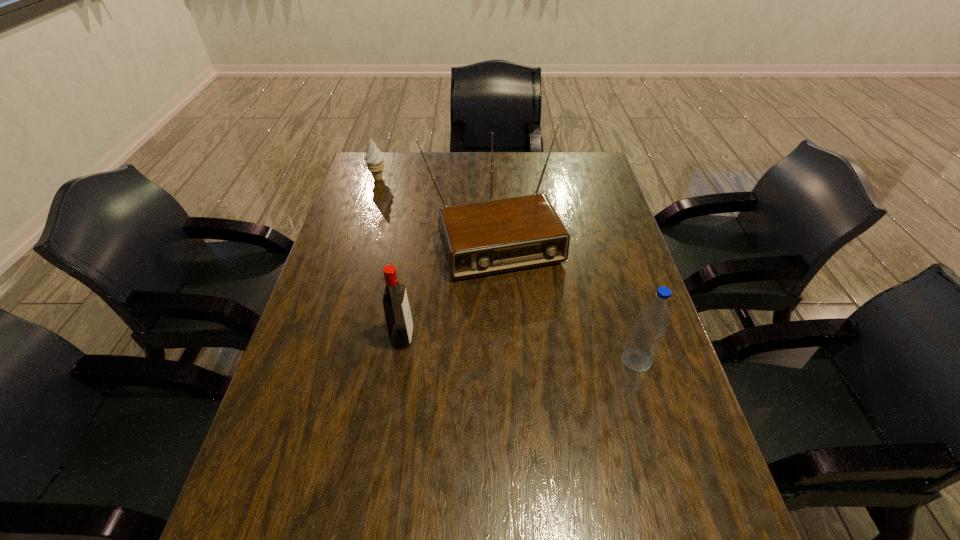
The height and width of the screenshot is (540, 960). I want to click on vacant region at the left edge of the desktop, so click(x=379, y=214).

Where is `vacant area at the right edge of the desktop`? The width and height of the screenshot is (960, 540). vacant area at the right edge of the desktop is located at coordinates (646, 441).

The height and width of the screenshot is (540, 960). Find the location of `vacant space at the far left corner`. vacant space at the far left corner is located at coordinates (385, 173).

Locate an element on the screen. This screenshot has height=540, width=960. vacant area at the near left corner is located at coordinates tap(259, 474).

At what (x,y) coordinates should I click in order to perform the action: click on blank region between the leftmost object and the third nearest object. Please return your answer as a coordinate pair (x, y). Image resolution: width=960 pixels, height=540 pixels. Looking at the image, I should click on (436, 207).

The width and height of the screenshot is (960, 540). I want to click on empty space that is in between the tallest object and the vodka, so click(448, 287).

Locate an element on the screen. Image resolution: width=960 pixels, height=540 pixels. vacant area between the farthest object and the tallest object is located at coordinates (436, 207).

Image resolution: width=960 pixels, height=540 pixels. Identify the location of vacant point located between the water bottle and the second farthest object. (564, 298).

This screenshot has height=540, width=960. I want to click on free spot between the vodka and the radio_receiver, so click(448, 287).

At what (x,y) coordinates should I click in order to perform the action: click on vacant space that's between the water bottle and the vodka. Please return your answer as a coordinate pair (x, y). Looking at the image, I should click on (519, 349).